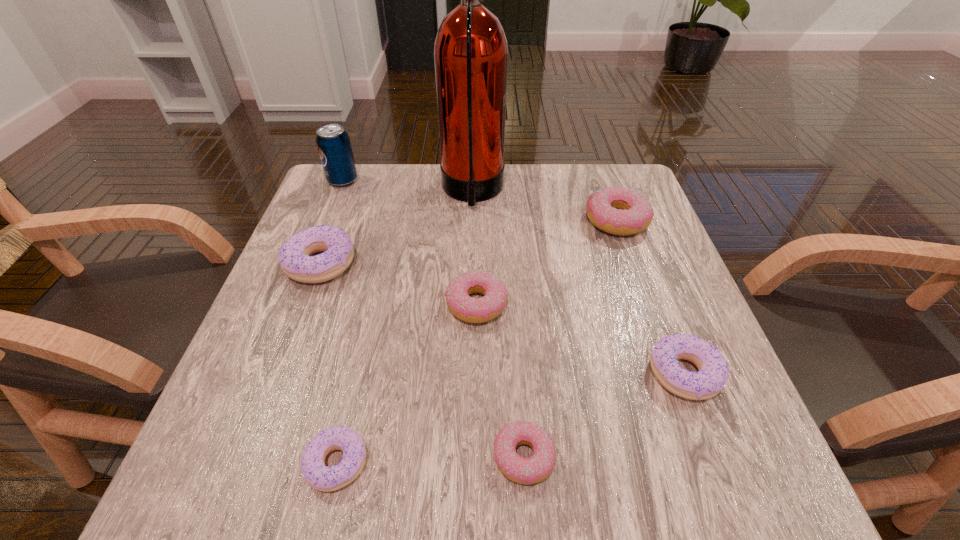
Image resolution: width=960 pixels, height=540 pixels. I want to click on fire extinguisher, so click(470, 51).

This screenshot has width=960, height=540. Find the location of `red fire extinguisher`. red fire extinguisher is located at coordinates (470, 51).

You are a GUI agent. You are given a task and a screenshot of the screen. Output one action in this format:
    pyautogui.click(x=<x>, y=<y>)
    Task: Click on the second tallest object
    This screenshot has width=960, height=540.
    Given the screenshot: What is the action you would take?
    pyautogui.click(x=333, y=143)

I want to click on the biggest pink doughnut, so click(x=622, y=211).

Where is `the farthest doughnut`? This screenshot has height=540, width=960. the farthest doughnut is located at coordinates (622, 211).

Identify the location of the farthest purple doughnut. (294, 256).

Where is `the leftmost doughnut`? the leftmost doughnut is located at coordinates (294, 256).

Locate an element on the screen. The width and height of the screenshot is (960, 540). the second nearest pink doughnut is located at coordinates (472, 310).

Identify the location of the second nearest purple doughnut. (713, 373).

The height and width of the screenshot is (540, 960). What are the coordinates of `the sixth farthest object` in the screenshot? It's located at (713, 373).